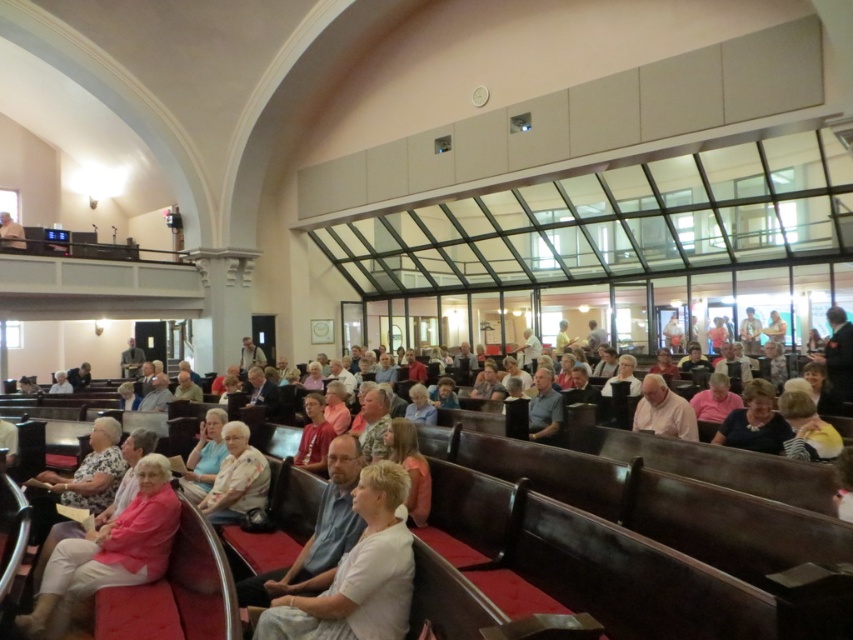
Question: Which point is farther to the camera?

Choices:
 (A) (363, 621)
 (B) (3, 225)

Answer: (B)

Question: Among these objects, which one is farthest from the camera?

Choices:
 (A) light beige shirt at center
 (B) white cotton shirt at center

Answer: (A)

Question: Is white cotton shirt at center wider than light beige fabric dress at center?

Choices:
 (A) no
 (B) yes

Answer: (B)

Question: Which object is the farthest from the white cotton shirt at center?

Choices:
 (A) light beige fabric dress at center
 (B) light beige fabric chair at lower left
 (C) light beige shirt at center

Answer: (C)

Question: Can you confirm if light beige fabric dress at center is bigger than light beige shirt at center?

Choices:
 (A) no
 (B) yes

Answer: (B)

Question: Can you confirm if light beige shirt at center is positioned above light brown wooden pulpit at upper left?

Choices:
 (A) no
 (B) yes

Answer: (A)